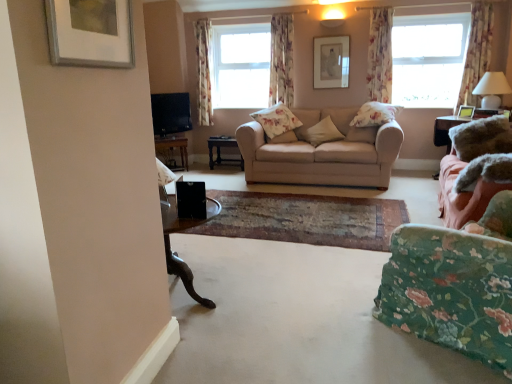
Question: From the image's perspective, would you say white glossy lampshade at right is shown under floral fabric curtain at upper center, which is the 1th curtain from left to right?

Choices:
 (A) yes
 (B) no

Answer: (A)

Question: Is white glossy lampshade at right wider than floral fabric curtain at upper center, which is the 1th curtain from left to right?

Choices:
 (A) no
 (B) yes

Answer: (B)

Question: Is white glossy lampshade at right in front of floral fabric curtain at upper center, which is the 1th curtain from left to right?

Choices:
 (A) yes
 (B) no

Answer: (A)

Question: Would you say white glossy lampshade at right is outside floral fabric curtain at upper center, which is the 1th curtain from left to right?

Choices:
 (A) yes
 (B) no

Answer: (A)

Question: From a real-world perspective, is white glossy lampshade at right physically below floral fabric curtain at upper center, which is the 1th curtain from left to right?

Choices:
 (A) no
 (B) yes

Answer: (B)

Question: From the image's perspective, is black plastic speaker at center located above or below floral fabric chair at lower right?

Choices:
 (A) below
 (B) above

Answer: (B)

Question: From their relative heights in the image, would you say black plastic speaker at center is taller or shorter than floral fabric chair at lower right?

Choices:
 (A) tall
 (B) short

Answer: (B)

Question: Is black plastic speaker at center in front of or behind floral fabric chair at lower right in the image?

Choices:
 (A) front
 (B) behind

Answer: (B)

Question: Is black plastic speaker at center wider or thinner than floral fabric chair at lower right?

Choices:
 (A) wide
 (B) thin

Answer: (B)

Question: From the image's perspective, is dark wood table at center, which is the first table from right to left, positioned above or below floral fabric curtain at upper center, acting as the 4th curtain starting from the right?

Choices:
 (A) above
 (B) below

Answer: (B)

Question: In terms of height, does dark wood table at center, the second table from the left, look taller or shorter compared to floral fabric curtain at upper center, acting as the 4th curtain starting from the right?

Choices:
 (A) short
 (B) tall

Answer: (A)

Question: Is dark wood table at center, which is the first table from right to left, bigger or smaller than floral fabric curtain at upper center, acting as the 4th curtain starting from the right?

Choices:
 (A) big
 (B) small

Answer: (A)

Question: From a real-world perspective, is dark wood table at center, which is the first table from right to left, above or below floral fabric curtain at upper center, acting as the 4th curtain starting from the right?

Choices:
 (A) below
 (B) above

Answer: (A)

Question: Looking at the image, does white fabric window at upper right seem bigger or smaller compared to beige fabric couch at center, the 1th studio couch in the back-to-front sequence?

Choices:
 (A) small
 (B) big

Answer: (A)

Question: From a real-world perspective, is white fabric window at upper right positioned above or below beige fabric couch at center, the second studio couch viewed from the front?

Choices:
 (A) above
 (B) below

Answer: (A)